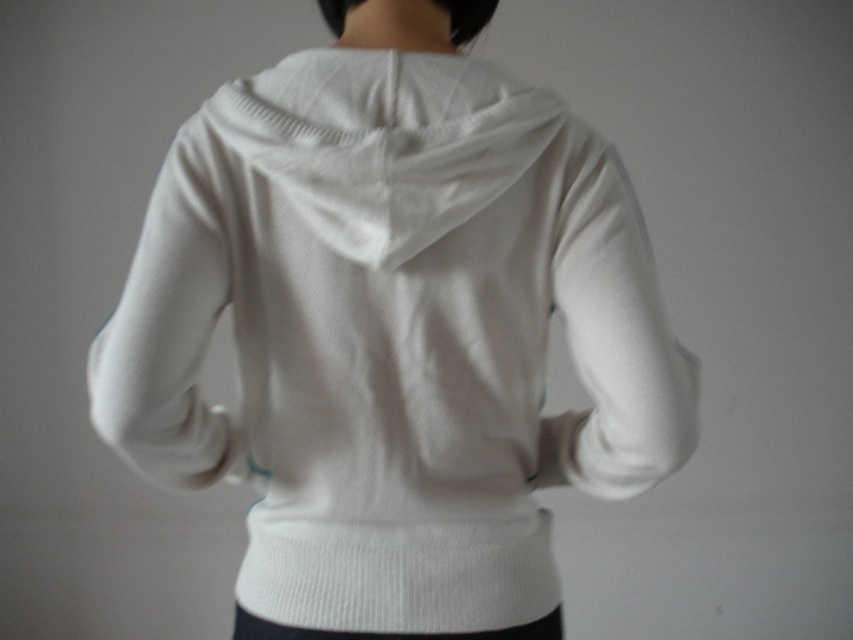
Question: Which point appears farthest from the camera in this image?

Choices:
 (A) (302, 161)
 (B) (281, 90)

Answer: (B)

Question: Does white knitted sweater at center appear under white knitted neckband at center?

Choices:
 (A) yes
 (B) no

Answer: (A)

Question: Is white knitted sweater at center in front of white knitted neckband at center?

Choices:
 (A) no
 (B) yes

Answer: (A)

Question: Can you confirm if white knitted sweater at center is bigger than white knitted neckband at center?

Choices:
 (A) yes
 (B) no

Answer: (A)